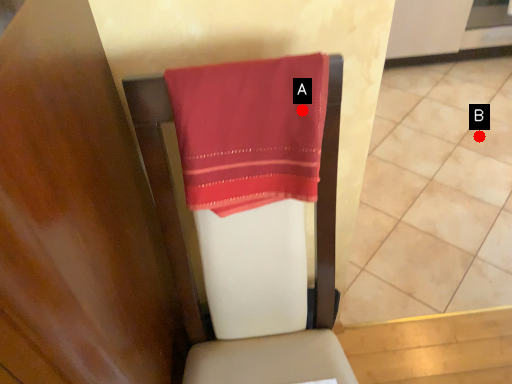
Question: Two points are circled on the image, labeled by A and B beside each circle. Which of the following is the closest to the observer?

Choices:
 (A) A is closer
 (B) B is closer

Answer: (A)